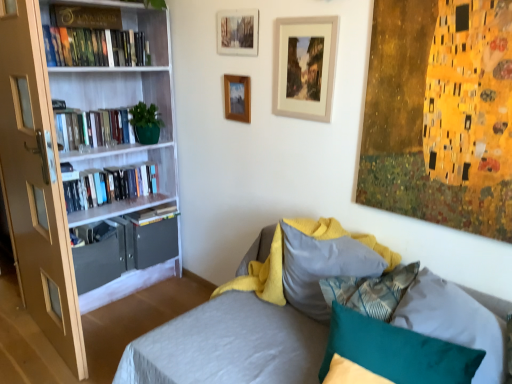
Image resolution: width=512 pixels, height=384 pixels. Find the location of `vacant space that's between white glossy bookcase at left and matte beige door at left`. vacant space that's between white glossy bookcase at left and matte beige door at left is located at coordinates (126, 322).